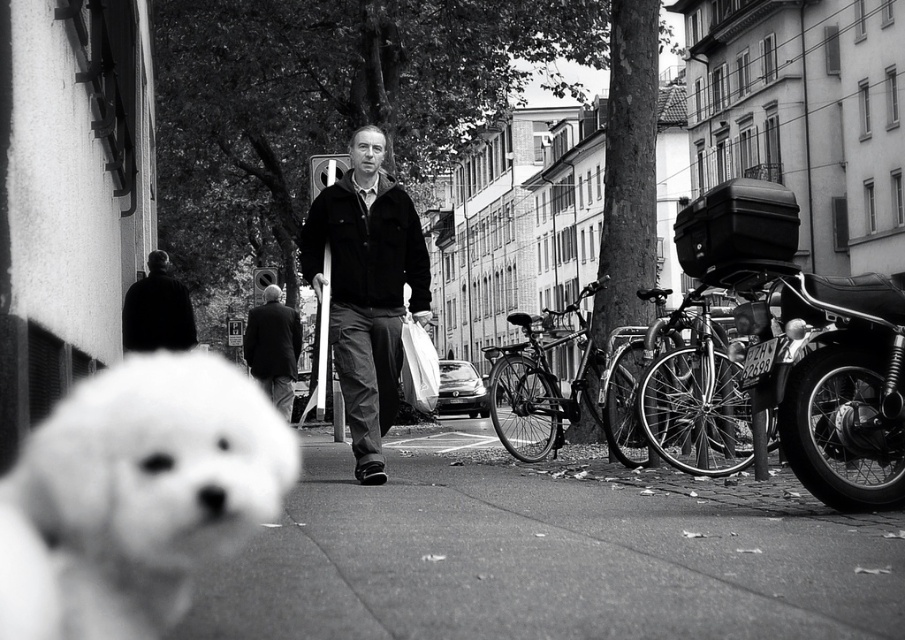
Question: Does fluffy white dog at lower left appear on the right side of dark gray suit at center?

Choices:
 (A) no
 (B) yes

Answer: (B)

Question: Does shiny black motorcycle at right appear on the left side of black matte jacket at upper left?

Choices:
 (A) yes
 (B) no

Answer: (B)

Question: Does shiny black motorcycle at right have a greater width compared to dark gray suit at center?

Choices:
 (A) no
 (B) yes

Answer: (A)

Question: Which object is positioned farthest from the fluffy white dog at lower left?

Choices:
 (A) smooth asphalt at center
 (B) dark gray suit at center
 (C) black matte jacket at center

Answer: (B)

Question: Which point appears closest to the camera in this image?

Choices:
 (A) (329, 321)
 (B) (35, 433)
 (C) (579, 536)
 (D) (782, 394)

Answer: (B)

Question: Which object is the closest to the smooth asphalt at center?

Choices:
 (A) black matte jacket at upper left
 (B) shiny black motorcycle at right
 (C) black matte jacket at center

Answer: (C)